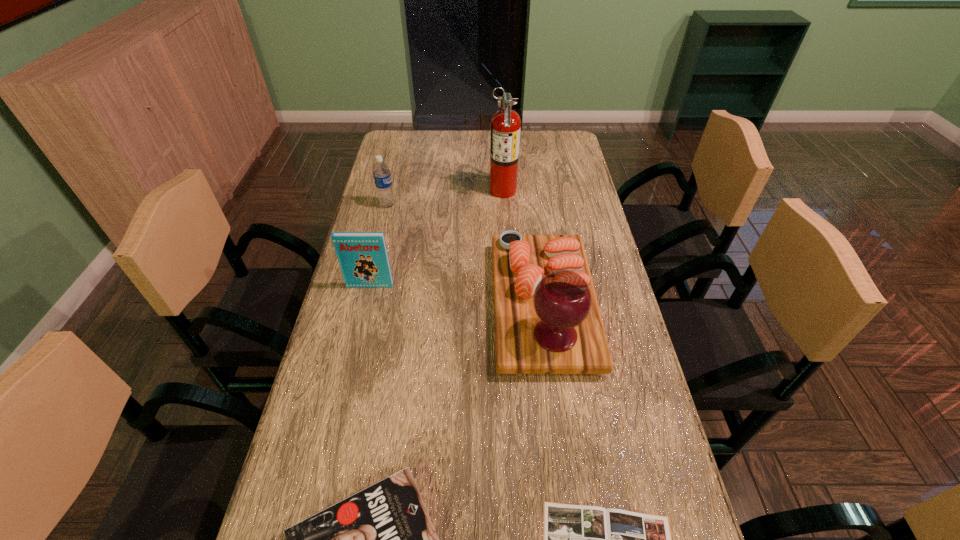
Image resolution: width=960 pixels, height=540 pixels. In order to click on fire extinguisher in this screenshot , I will do `click(505, 125)`.

You are a GUI agent. You are given a task and a screenshot of the screen. Output one action in this format:
    pyautogui.click(x=<x>, y=<y>)
    Task: Click on the platter
    The image size is (960, 540).
    Given the screenshot: What is the action you would take?
    pyautogui.click(x=547, y=320)

Locate an element on the screen. The height and width of the screenshot is (540, 960). the tallest book is located at coordinates (363, 258).

At what (x,y) coordinates should I click in order to perform the action: click on water bottle. Please return your answer as a coordinate pair (x, y). This screenshot has height=540, width=960. Looking at the image, I should click on (x=381, y=172).

Find the location of `free space located 0.120m on the nozzle side of the fire extinguisher`. free space located 0.120m on the nozzle side of the fire extinguisher is located at coordinates (455, 190).

Where is `free space located 0.140m on the nozzle side of the fire extinguisher`? free space located 0.140m on the nozzle side of the fire extinguisher is located at coordinates (449, 190).

Image resolution: width=960 pixels, height=540 pixels. Identify the location of vacant space situated 0.300m on the nozzle side of the fire extinguisher. click(x=404, y=190).

Where is `vacant space located on the front of the fifth shortest object`? vacant space located on the front of the fifth shortest object is located at coordinates (557, 411).

I want to click on vacant position located on the front cover of the tallest book, so click(x=341, y=410).

Where is `free spot located 0.070m on the right of the water bottle`? The width and height of the screenshot is (960, 540). free spot located 0.070m on the right of the water bottle is located at coordinates (416, 205).